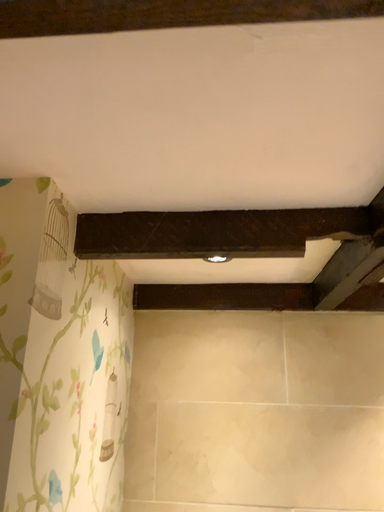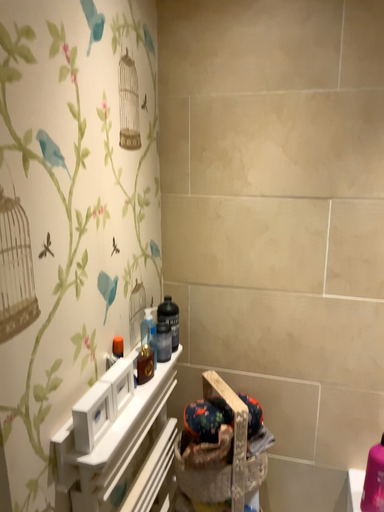
Question: Which way did the camera rotate in the video?

Choices:
 (A) rotated right
 (B) rotated left

Answer: (B)